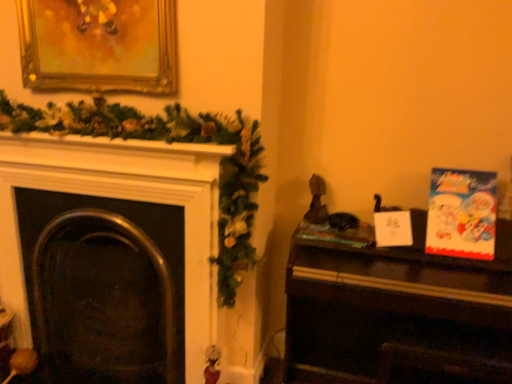
This screenshot has height=384, width=512. In order to click on free space in front of cartoon paper christmas card at right in this screenshot , I will do (x=467, y=257).